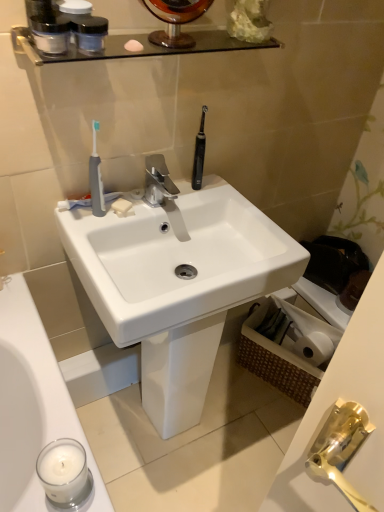
This screenshot has height=512, width=384. I want to click on unoccupied area behind polished chrome faucet at center, so click(187, 188).